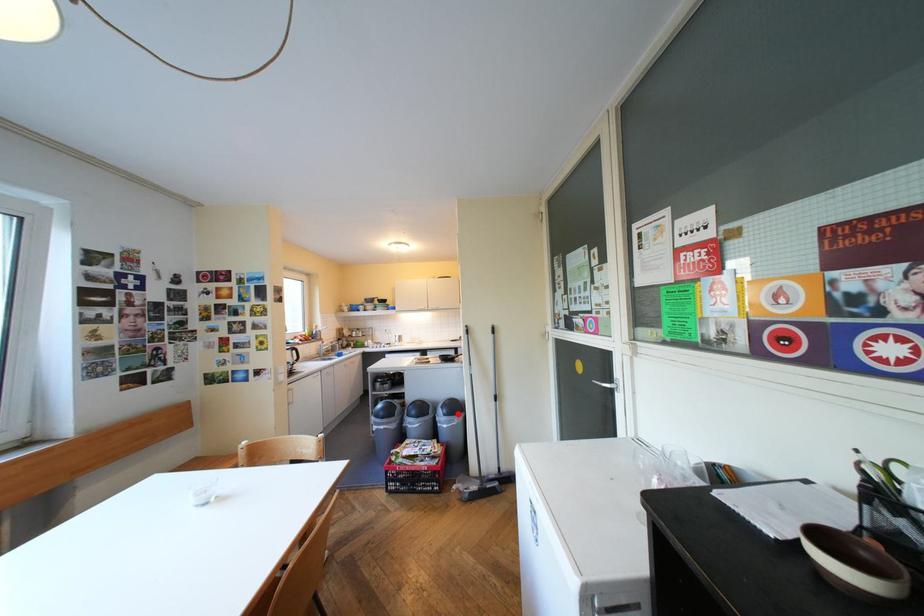
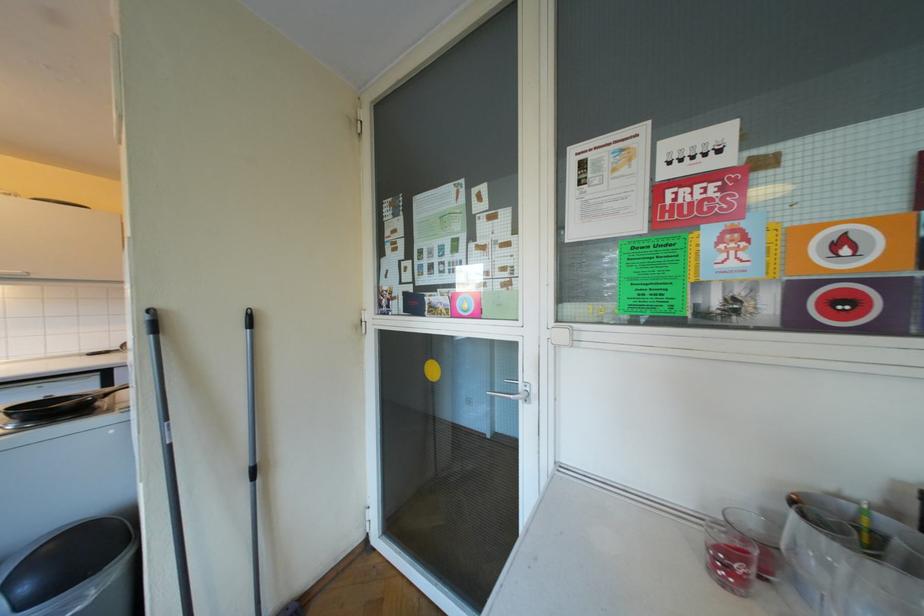
In the second image, find the point that corresponds to the highlighted location in the first image.

(40, 602)